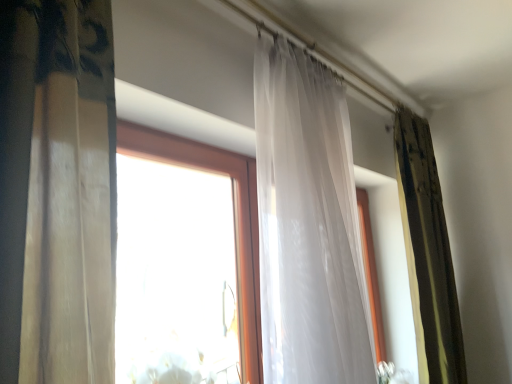
Question: In the image, is green textured curtain at right, acting as the 2th curtain starting from the front, on the left side or the right side of translucent white curtain at center, arranged as the first curtain when viewed from the left?

Choices:
 (A) left
 (B) right

Answer: (B)

Question: Is point (433, 274) closer or farther from the camera than point (344, 130)?

Choices:
 (A) closer
 (B) farther

Answer: (B)

Question: From a real-world perspective, is green textured curtain at right, arranged as the first curtain when viewed from the right, positioned above or below translucent white curtain at center, arranged as the first curtain when viewed from the left?

Choices:
 (A) above
 (B) below

Answer: (B)

Question: Looking at the image, does translucent white curtain at center, arranged as the first curtain when viewed from the left, seem bigger or smaller compared to green textured curtain at right, the 2th curtain viewed from the left?

Choices:
 (A) small
 (B) big

Answer: (B)

Question: Is translucent white curtain at center, positioned as the first curtain in front-to-back order, in front of or behind green textured curtain at right, acting as the 2th curtain starting from the front, in the image?

Choices:
 (A) front
 (B) behind

Answer: (A)

Question: From the image's perspective, is translucent white curtain at center, positioned as the first curtain in front-to-back order, above or below green textured curtain at right, the first curtain viewed from the back?

Choices:
 (A) above
 (B) below

Answer: (A)

Question: Which is correct: translucent white curtain at center, which is counted as the 2th curtain, starting from the right, is inside green textured curtain at right, acting as the 2th curtain starting from the front, or outside of it?

Choices:
 (A) inside
 (B) outside

Answer: (B)